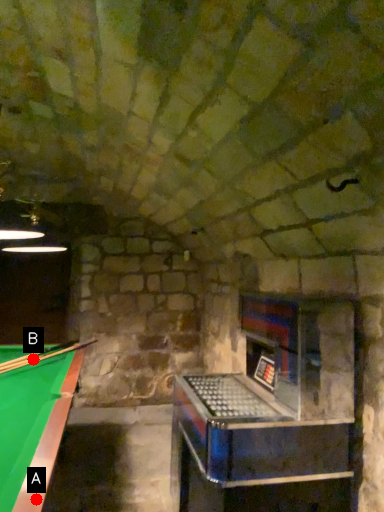
Question: Two points are circled on the image, labeled by A and B beside each circle. Which point is farther from the camera taking this photo?

Choices:
 (A) A is further
 (B) B is further

Answer: (B)